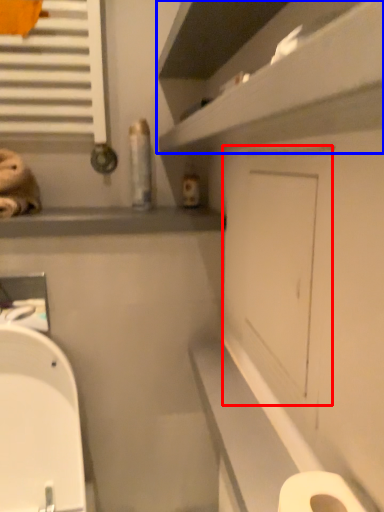
Question: Which object is further to the camera taking this photo, screen door (highlighted by a red box) or shelf (highlighted by a blue box)?

Choices:
 (A) screen door
 (B) shelf

Answer: (A)